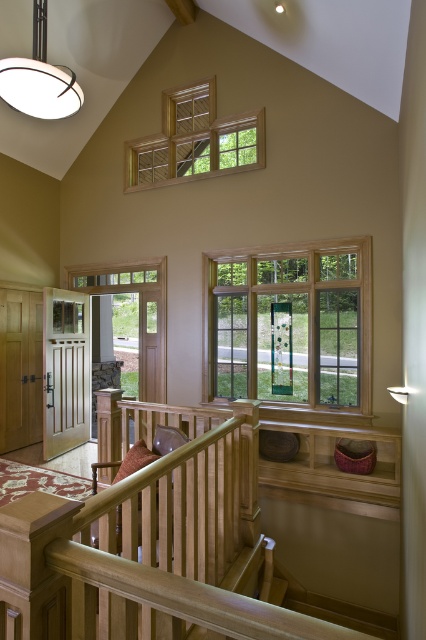
Question: Which of the following is the farthest from the observer?

Choices:
 (A) (166, 182)
 (B) (319, 337)
 (C) (180, 404)

Answer: (A)

Question: Is wooden rail at center to the right of wooden balustrade at center from the viewer's perspective?

Choices:
 (A) no
 (B) yes

Answer: (A)

Question: Which point is closer to the camera?

Choices:
 (A) (152, 420)
 (B) (94, 324)
 (C) (195, 128)
 (D) (154, 480)

Answer: (D)

Question: Is clear glass window at center closer to camera compared to clear glass door at left?

Choices:
 (A) no
 (B) yes

Answer: (B)

Question: Does clear glass window at upper center have a lesser width compared to clear glass door at left?

Choices:
 (A) yes
 (B) no

Answer: (A)

Question: Which of the following is the farthest from the observer?

Choices:
 (A) (149, 387)
 (B) (385, 502)
 (C) (138, 630)
 (D) (334, 257)

Answer: (A)